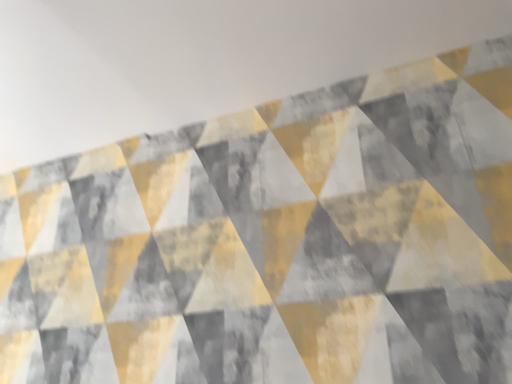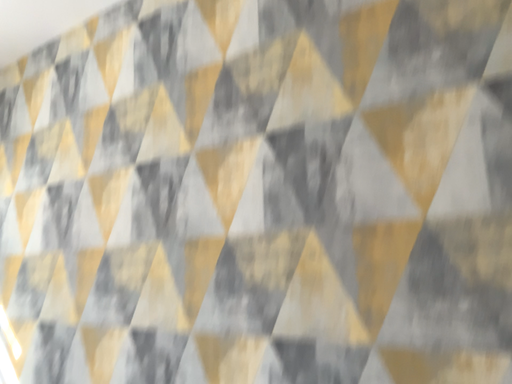
Question: Which way did the camera rotate in the video?

Choices:
 (A) rotated downward
 (B) rotated upward

Answer: (A)